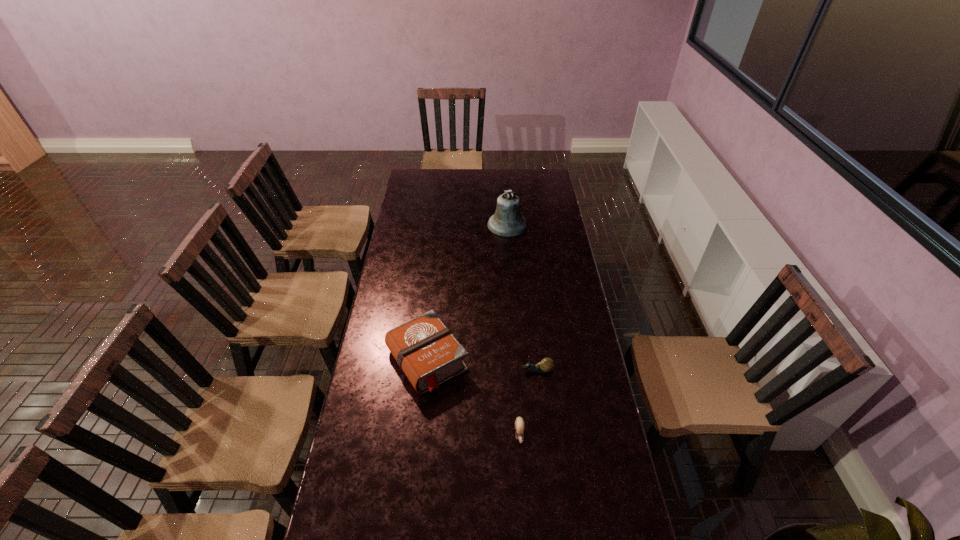
I want to click on the tallest object, so click(507, 221).

This screenshot has width=960, height=540. What are the coordinates of `the farthest object` in the screenshot? It's located at (507, 221).

You are a GUI agent. You are given a task and a screenshot of the screen. Output one action in this format:
    pyautogui.click(x=<x>, y=<y>)
    Task: Click on the second tallest object
    Image resolution: width=960 pixels, height=540 pixels.
    Given the screenshot: What is the action you would take?
    pyautogui.click(x=426, y=350)

Locate an element on the screen. Bible is located at coordinates (426, 350).

You are a GUI agent. You are given a task and a screenshot of the screen. Output one action in this format:
    pyautogui.click(x=<x>, y=<y>)
    Task: Click on the second shortest object
    
    Given the screenshot: What is the action you would take?
    pyautogui.click(x=546, y=365)

Locate an element on the screen. This screenshot has width=960, height=540. the right escargot is located at coordinates (546, 365).

The image size is (960, 540). I want to click on the left escargot, so click(x=519, y=422).

This screenshot has height=540, width=960. I want to click on the shorter escargot, so click(x=519, y=422).

The image size is (960, 540). What are the coordinates of `free spot located on the left of the tallest object` in the screenshot? It's located at (474, 225).

Where is `vacant area situated on the right of the leftmost object`? The image size is (960, 540). vacant area situated on the right of the leftmost object is located at coordinates (576, 360).